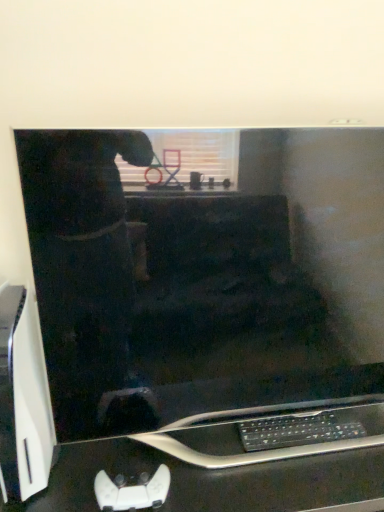
In order to face black glossy computer desk at lower center, should I rotate leftwards or rightwards?

To face it directly, rotate right by 7.026 degrees.

Describe the element at coordinates (209, 480) in the screenshot. This screenshot has width=384, height=512. I see `black glossy computer desk at lower center` at that location.

Image resolution: width=384 pixels, height=512 pixels. In order to click on black glossy computer desk at lower center in this screenshot , I will do `click(209, 480)`.

Locate an element on the screen. This screenshot has height=512, width=384. black plastic keyboard at lower center is located at coordinates (297, 430).

This screenshot has width=384, height=512. Describe the element at coordinates (297, 430) in the screenshot. I see `black plastic keyboard at lower center` at that location.

I want to click on black glossy computer desk at lower center, so click(x=209, y=480).

Which is more to the left, black plastic keyboard at lower center or black glossy computer desk at lower center?

From the viewer's perspective, black glossy computer desk at lower center appears more on the left side.

Which object is further away from the camera taking this photo, black plastic keyboard at lower center or black glossy computer desk at lower center?

black plastic keyboard at lower center is further from the camera.

Is point (301, 421) less distant than point (239, 384)?

No, (301, 421) is behind (239, 384).

Based on the photo, from the image's perspective, is black plastic keyboard at lower center above or below black glossy computer desk at lower center?

From the image's perspective, black plastic keyboard at lower center appears above black glossy computer desk at lower center.

From a real-world perspective, which is physically above, black plastic keyboard at lower center or black glossy computer desk at lower center?

black plastic keyboard at lower center.

Can you confirm if black plastic keyboard at lower center is thinner than black glossy computer desk at lower center?

Correct, the width of black plastic keyboard at lower center is less than that of black glossy computer desk at lower center.

Can you confirm if black plastic keyboard at lower center is taller than black glossy computer desk at lower center?

No, black plastic keyboard at lower center is not taller than black glossy computer desk at lower center.

Does black plastic keyboard at lower center have a smaller size compared to black glossy computer desk at lower center?

Indeed, black plastic keyboard at lower center has a smaller size compared to black glossy computer desk at lower center.

Would you say black plastic keyboard at lower center is outside black glossy computer desk at lower center?

No, black plastic keyboard at lower center is not outside of black glossy computer desk at lower center.

Can you see black plastic keyboard at lower center touching black glossy computer desk at lower center?

No, black plastic keyboard at lower center is not touching black glossy computer desk at lower center.

In the scene shown: Is black plastic keyboard at lower center aimed at black glossy computer desk at lower center?

Yes, black plastic keyboard at lower center is oriented towards black glossy computer desk at lower center.

How far apart are black plastic keyboard at lower center and black glossy computer desk at lower center?

A distance of 5.49 inches exists between black plastic keyboard at lower center and black glossy computer desk at lower center.

Identify the location of computer desk in front of the black plastic keyboard at lower center. (209, 480).

From the picture: Considering the relative positions of black glossy computer desk at lower center and black plastic keyboard at lower center in the image provided, is black glossy computer desk at lower center to the left or to the right of black plastic keyboard at lower center?

From the image, it's evident that black glossy computer desk at lower center is to the left of black plastic keyboard at lower center.

Considering the positions of objects black glossy computer desk at lower center and black plastic keyboard at lower center in the image provided, who is behind, black glossy computer desk at lower center or black plastic keyboard at lower center?

black plastic keyboard at lower center is more distant.

Is point (280, 501) farther from viewer compared to point (348, 424)?

No, it is in front of (348, 424).

From the image's perspective, between black glossy computer desk at lower center and black plastic keyboard at lower center, who is located below?

black glossy computer desk at lower center, from the image's perspective.

From a real-world perspective, is black glossy computer desk at lower center below black plastic keyboard at lower center?

Correct, in the physical world, black glossy computer desk at lower center is lower than black plastic keyboard at lower center.

Considering the sizes of black glossy computer desk at lower center and black plastic keyboard at lower center in the image, is black glossy computer desk at lower center wider or thinner than black plastic keyboard at lower center?

Considering their sizes, black glossy computer desk at lower center looks broader than black plastic keyboard at lower center.

Considering the relative sizes of black glossy computer desk at lower center and black plastic keyboard at lower center in the image provided, is black glossy computer desk at lower center taller than black plastic keyboard at lower center?

Yes, black glossy computer desk at lower center is taller than black plastic keyboard at lower center.

Who is smaller, black glossy computer desk at lower center or black plastic keyboard at lower center?

With smaller size is black plastic keyboard at lower center.

Is black glossy computer desk at lower center surrounding black plastic keyboard at lower center?

That's correct, black plastic keyboard at lower center is inside black glossy computer desk at lower center.

Consider the image. Would you say black glossy computer desk at lower center is a long distance from black plastic keyboard at lower center?

That's not correct — black glossy computer desk at lower center is a little close to black plastic keyboard at lower center.

Is black plastic keyboard at lower center at the back of black glossy computer desk at lower center?

No, black glossy computer desk at lower center's orientation is not away from black plastic keyboard at lower center.

Measure the distance between black glossy computer desk at lower center and black plastic keyboard at lower center.

A distance of 5.49 inches exists between black glossy computer desk at lower center and black plastic keyboard at lower center.

The width and height of the screenshot is (384, 512). In order to click on computer desk on the left of black plastic keyboard at lower center in this screenshot , I will do `click(209, 480)`.

Locate an element on the screen. The height and width of the screenshot is (512, 384). computer desk that is on the left side of black plastic keyboard at lower center is located at coordinates (209, 480).

You are a GUI agent. You are given a task and a screenshot of the screen. Output one action in this format:
    pyautogui.click(x=<x>, y=<y>)
    Task: Click on the computer desk in front of the black plastic keyboard at lower center
    
    Given the screenshot: What is the action you would take?
    pyautogui.click(x=209, y=480)